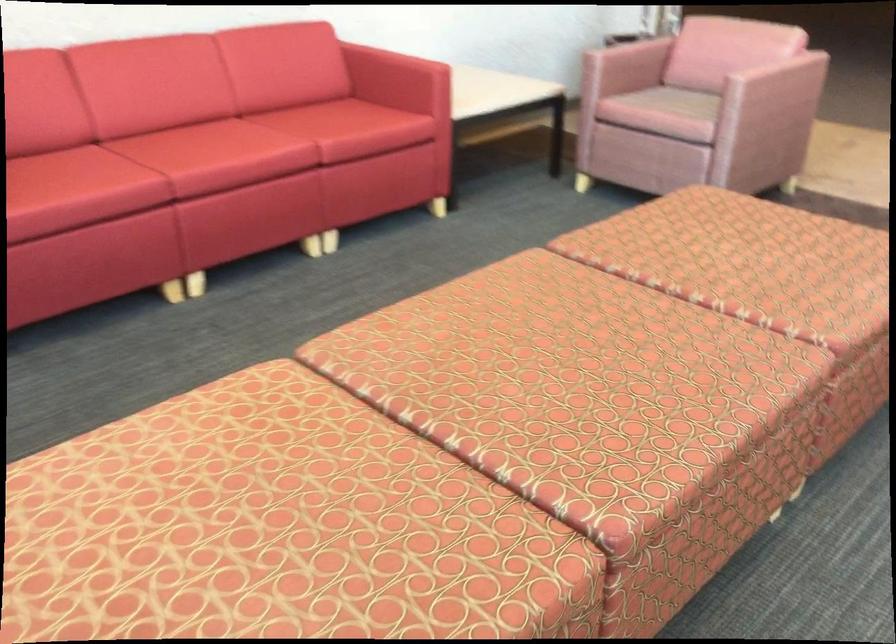
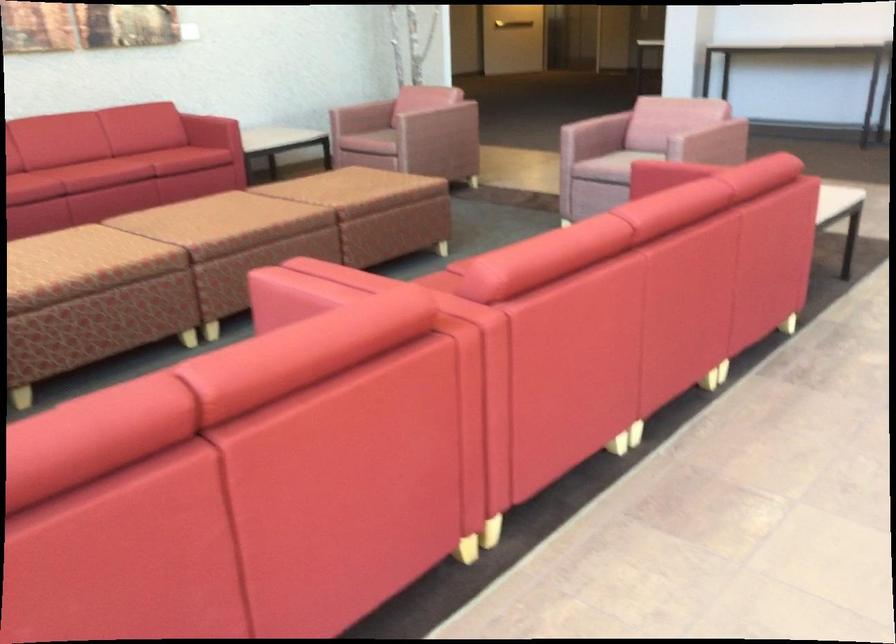
What movement of the cameraman would produce the second image?

The cameraman moved toward right, backward.